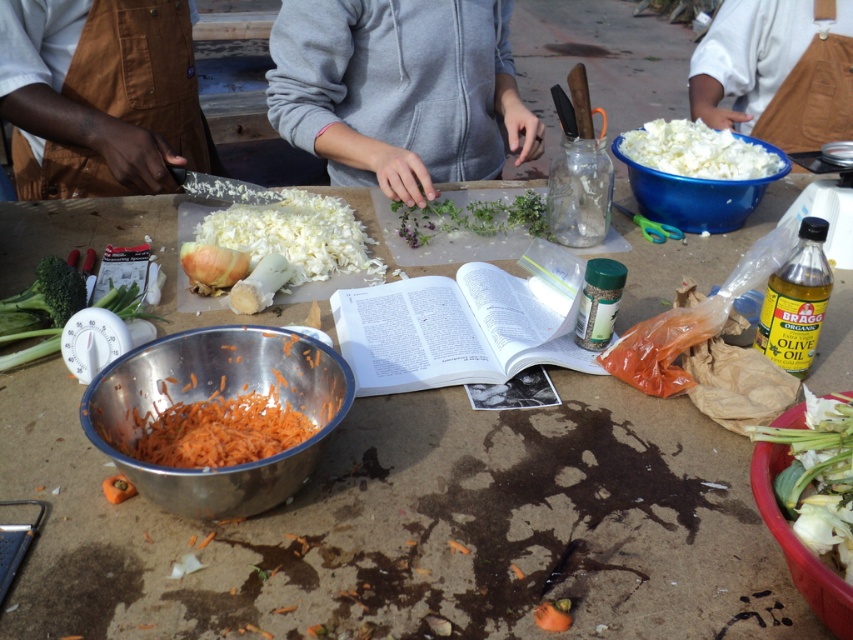
Does blue plastic bowl at upper right appear on the left side of white plastic timer at lower left?

No, blue plastic bowl at upper right is not to the left of white plastic timer at lower left.

This screenshot has width=853, height=640. Find the location of `blue plastic bowl at upper right`. blue plastic bowl at upper right is located at coordinates (697, 195).

Find the location of `blue plastic bowl at upper right`. blue plastic bowl at upper right is located at coordinates (697, 195).

The image size is (853, 640). Identify the location of shiny metallic bowl at lower left. (213, 397).

How much distance is there between shiny metallic bowl at lower left and green leafy herb at center?

They are 19.72 inches apart.

Where is `shiny metallic bowl at lower left`? The height and width of the screenshot is (640, 853). shiny metallic bowl at lower left is located at coordinates (213, 397).

Where is `shiny metallic bowl at lower left`? shiny metallic bowl at lower left is located at coordinates (213, 397).

What do you see at coordinates (100, 96) in the screenshot? I see `brown canvas apron at left` at bounding box center [100, 96].

Locate an element on the screen. brown canvas apron at left is located at coordinates (100, 96).